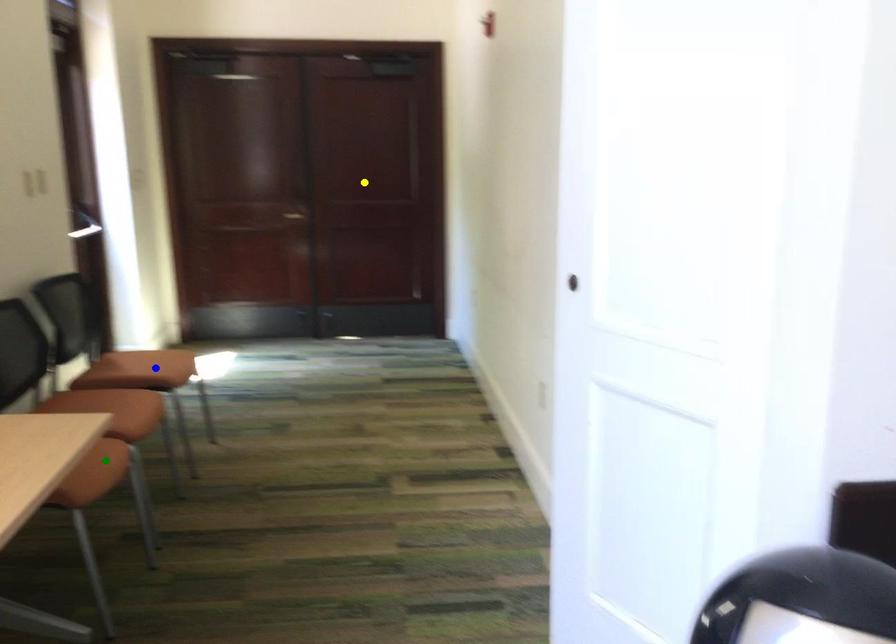
Order these from nearest to farthest:
yellow point, blue point, green point

green point
blue point
yellow point